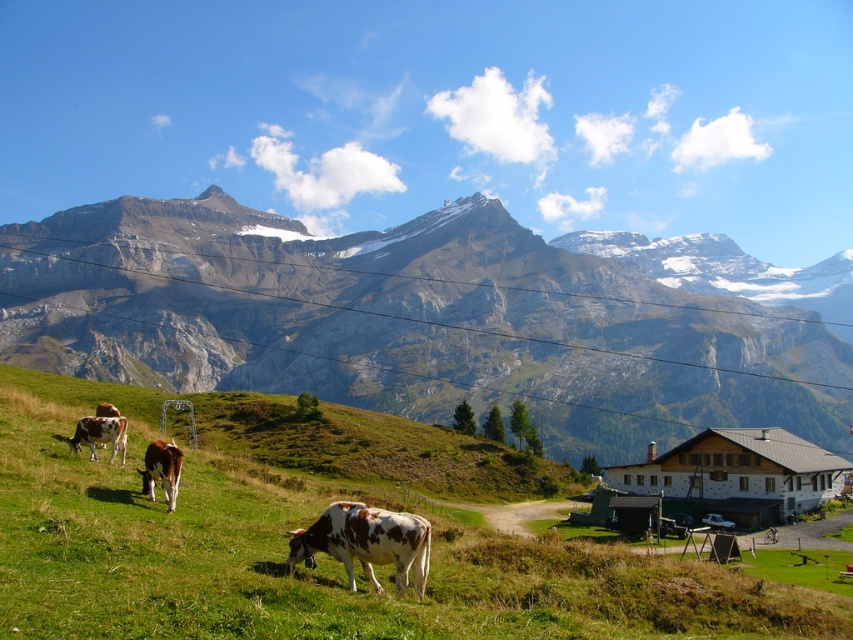
Is point (416, 348) farther from viewer compared to point (108, 429)?

Yes, it is.

Between point (412, 227) and point (96, 435), which one is positioned behind?

Positioned behind is point (412, 227).

At what (x,y) coordinates should I click in order to perform the action: click on rocky gray mountain range at upper center. Please return your answer as a coordinate pair (x, y). Looking at the image, I should click on (408, 321).

Identify the location of rocky gray mountain range at upper center. (408, 321).

Does green grassy at lower left appear on the left side of brown speckled cow at lower left?

In fact, green grassy at lower left is to the right of brown speckled cow at lower left.

Between point (469, 460) and point (160, 477), which one is positioned behind?

Positioned behind is point (469, 460).

Image resolution: width=853 pixels, height=640 pixels. What are the coordinates of `green grassy at lower left` in the screenshot? It's located at (315, 556).

Can you confirm if brown and white spotted cow at lower center is positioned to the left of brown and white spotted cow at lower left?

Incorrect, brown and white spotted cow at lower center is not on the left side of brown and white spotted cow at lower left.

Who is lower down, brown and white spotted cow at lower center or brown and white spotted cow at lower left?

brown and white spotted cow at lower center is lower down.

Does point (387, 544) come in front of point (115, 444)?

Yes.

You are a GUI agent. You are given a task and a screenshot of the screen. Output one action in this format:
    pyautogui.click(x=<x>, y=<y>)
    Task: Click on the brown and white spotted cow at lower center
    
    Given the screenshot: What is the action you would take?
    pyautogui.click(x=366, y=541)